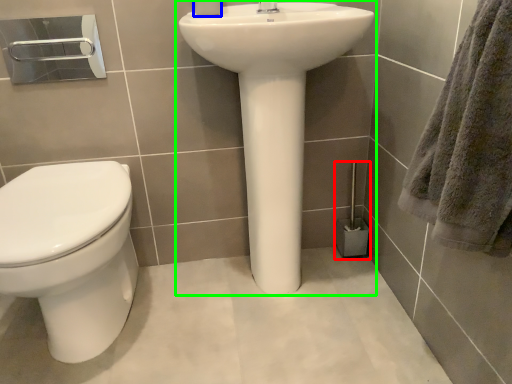
Question: Which object is the farthest from brush (highlighted by a red box)? Choose among these: toilet paper (highlighted by a blue box) or sink (highlighted by a green box).

Choices:
 (A) toilet paper
 (B) sink

Answer: (A)